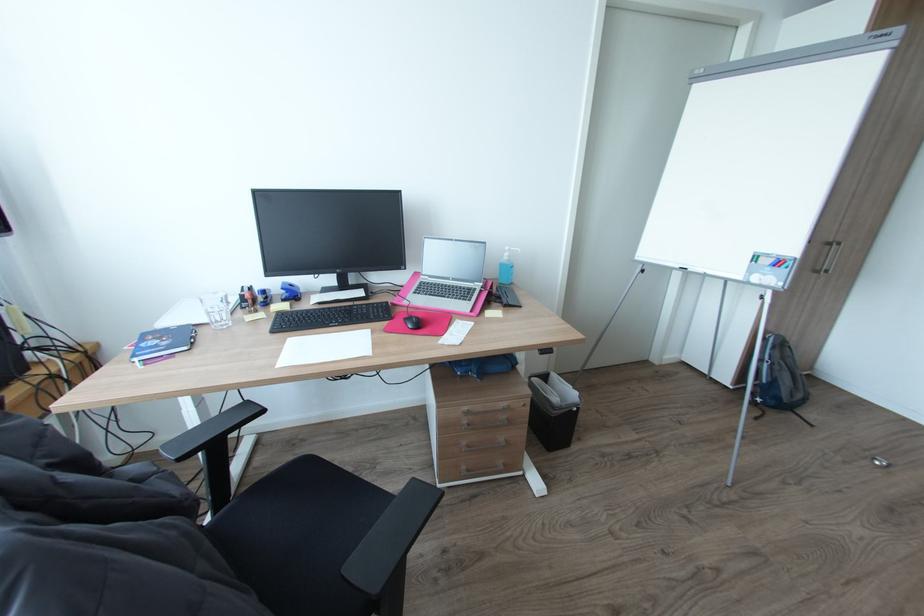
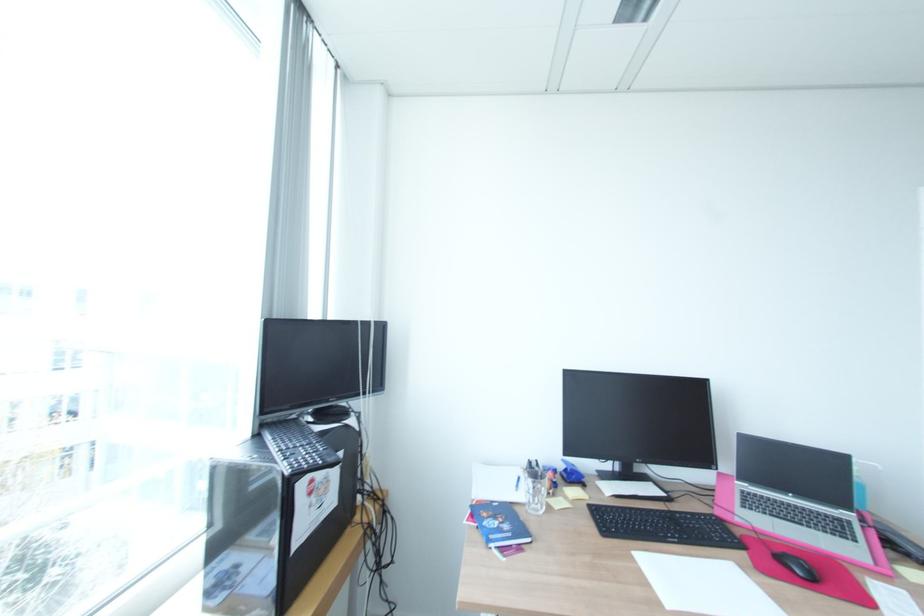
Where in the second image is the point corresponding to the point at 225,321 from the first image?

(541, 505)